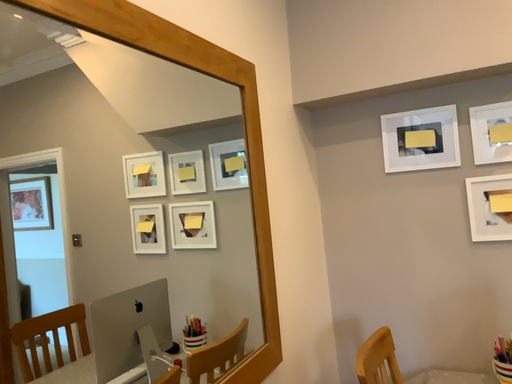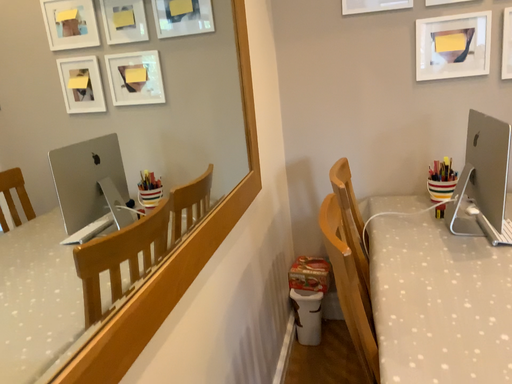
Question: Which way did the camera rotate in the video?

Choices:
 (A) rotated left
 (B) rotated right

Answer: (B)